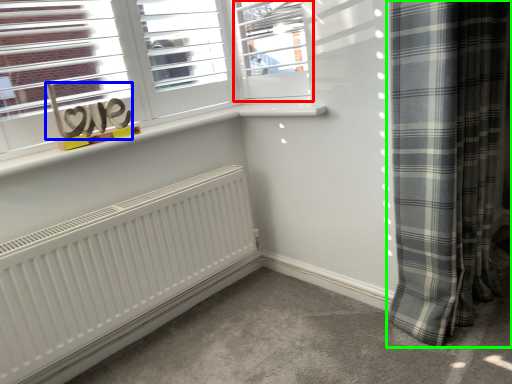
Question: Estimate the real-world distances between objects in this image. Which object is closer to window (highlighted by a red box), writing (highlighted by a blue box) or curtain (highlighted by a green box)?

Choices:
 (A) writing
 (B) curtain

Answer: (B)